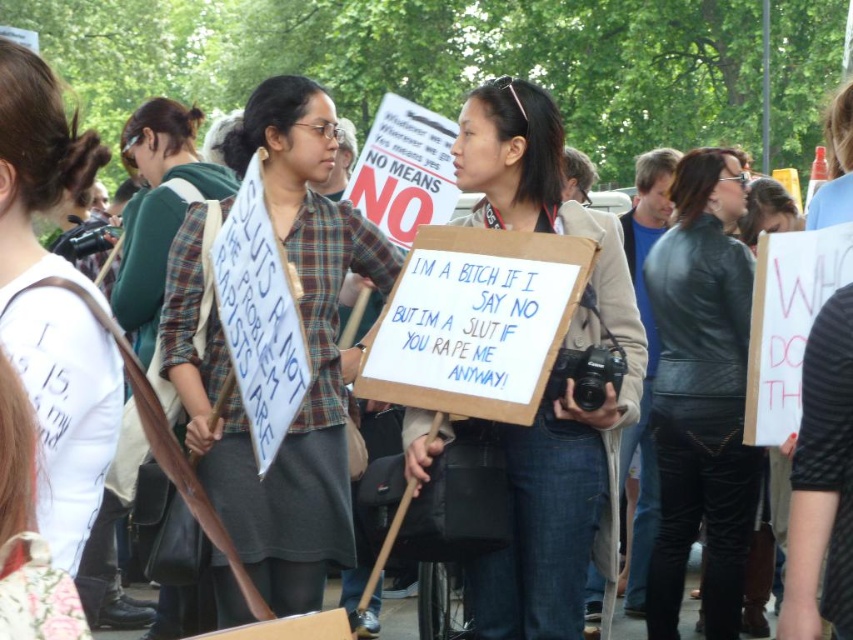
Question: In this image, where is plaid shirt at center located relative to leather jacket at center?

Choices:
 (A) below
 (B) above

Answer: (B)

Question: Among these points, which one is nearest to the camera?

Choices:
 (A) (700, 337)
 (B) (352, 250)

Answer: (B)

Question: Which of the following is the farthest from the observer?

Choices:
 (A) (709, 540)
 (B) (134, 198)
 (C) (630, 310)
 (D) (328, 148)

Answer: (B)

Question: Can you confirm if leather jacket at center is bigger than green plaid shirt at upper left?

Choices:
 (A) yes
 (B) no

Answer: (B)

Question: Which point is farther to the camera?

Choices:
 (A) plaid shirt at center
 (B) green plaid shirt at upper left
 (C) leather jacket at center
 (D) cardboard sign at center

Answer: (C)

Question: Can you confirm if cardboard sign at center is positioned below green plaid shirt at upper left?

Choices:
 (A) no
 (B) yes

Answer: (B)